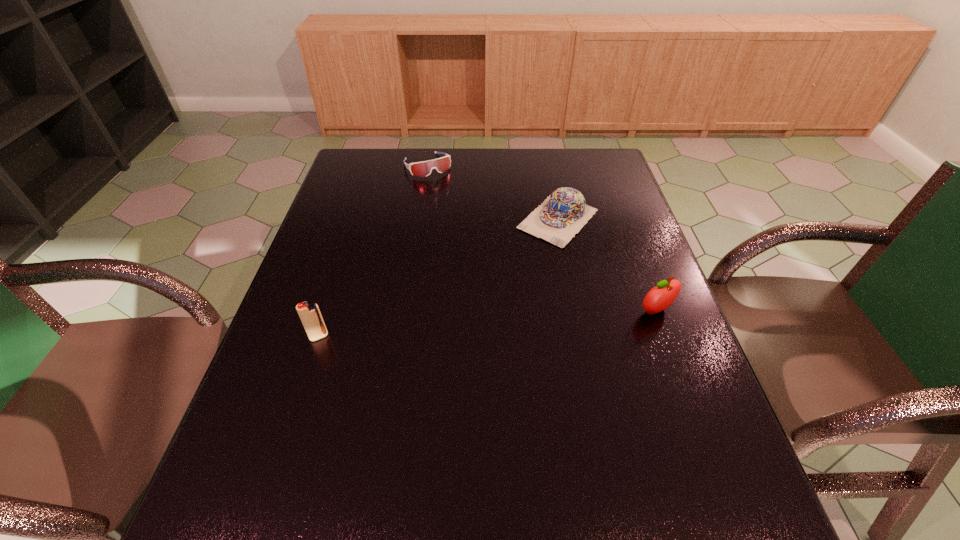
Locate an element on the screen. vacant spot on the desktop that is between the igniter and the rightmost object and is positioned on the front, side, and top of the third object from left to right is located at coordinates (x=454, y=326).

Where is `free space on the desktop that is between the nearest object and the apple and is positioned on the front-facing side of the second object from left to right`? The height and width of the screenshot is (540, 960). free space on the desktop that is between the nearest object and the apple and is positioned on the front-facing side of the second object from left to right is located at coordinates (527, 321).